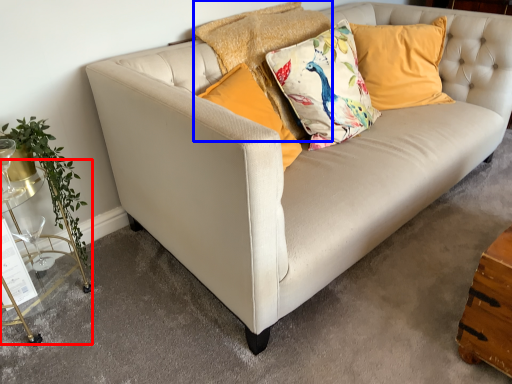
Question: Which object is closer to the camera taking this photo, table (highlighted by a red box) or pillow (highlighted by a blue box)?

Choices:
 (A) table
 (B) pillow

Answer: (A)